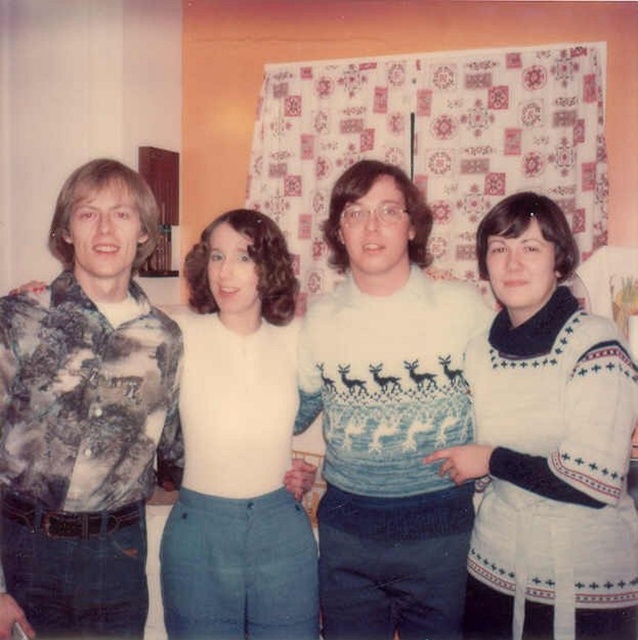
Question: Which object is the farthest from the white knitted sweater at center?

Choices:
 (A) white matte sweater at center
 (B) printed fabric shirt at left

Answer: (B)

Question: Is printed fabric shirt at left to the right of white knitted sweater at center from the viewer's perspective?

Choices:
 (A) no
 (B) yes

Answer: (A)

Question: Does printed fabric shirt at left appear under white matte sweater at center?

Choices:
 (A) no
 (B) yes

Answer: (A)

Question: Which object is positioned closest to the white matte sweater at center?

Choices:
 (A) printed fabric shirt at left
 (B) white knitted sweater at center

Answer: (A)

Question: Does white knitted sweater at center lie behind white matte sweater at center?

Choices:
 (A) yes
 (B) no

Answer: (B)

Question: Which is nearer to the printed fabric shirt at left?

Choices:
 (A) white matte sweater at center
 (B) white knitted sweater at center

Answer: (A)